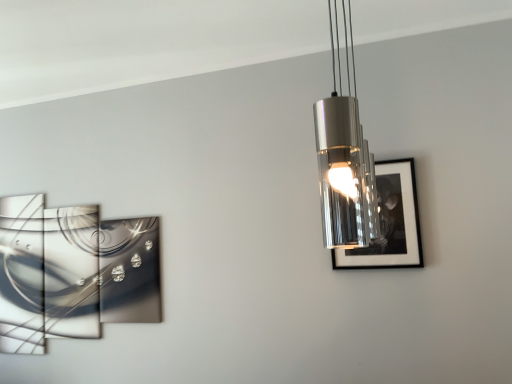
Question: Visually, is metallic reflective artwork at left, placed as the 1th picture frame when sorted from back to front, positioned to the left or to the right of metallic cylindrical light fixture at upper center?

Choices:
 (A) right
 (B) left

Answer: (B)

Question: Considering the positions of metallic reflective artwork at left, which is the first picture frame from left to right, and metallic cylindrical light fixture at upper center in the image, is metallic reflective artwork at left, which is the first picture frame from left to right, bigger or smaller than metallic cylindrical light fixture at upper center?

Choices:
 (A) big
 (B) small

Answer: (B)

Question: Which of these objects is positioned farthest from the black glossy picture frame at right, positioned as the first picture frame in right-to-left order?

Choices:
 (A) metallic reflective artwork at left, the second picture frame positioned from the right
 (B) metallic cylindrical light fixture at upper center

Answer: (A)

Question: Considering the real-world distances, which object is closest to the metallic cylindrical light fixture at upper center?

Choices:
 (A) black glossy picture frame at right, acting as the 1th picture frame starting from the front
 (B) metallic reflective artwork at left, which is the first picture frame from left to right

Answer: (A)